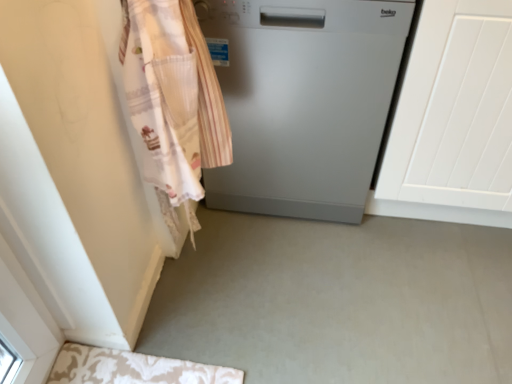
Question: From the image's perspective, is white lace apron at left below satin silver dishwasher at center?

Choices:
 (A) no
 (B) yes

Answer: (B)

Question: Is white lace apron at left at the left side of satin silver dishwasher at center?

Choices:
 (A) no
 (B) yes

Answer: (B)

Question: Considering the relative sizes of white lace apron at left and satin silver dishwasher at center in the image provided, is white lace apron at left taller than satin silver dishwasher at center?

Choices:
 (A) yes
 (B) no

Answer: (A)

Question: Is white lace apron at left positioned behind satin silver dishwasher at center?

Choices:
 (A) no
 (B) yes

Answer: (A)

Question: From the image's perspective, is white lace apron at left above satin silver dishwasher at center?

Choices:
 (A) no
 (B) yes

Answer: (A)

Question: In terms of width, does white lace apron at left look wider or thinner when compared to satin silver dishwasher at center?

Choices:
 (A) wide
 (B) thin

Answer: (B)

Question: Do you think white lace apron at left is within satin silver dishwasher at center, or outside of it?

Choices:
 (A) outside
 (B) inside

Answer: (A)

Question: Considering the positions of white lace apron at left and satin silver dishwasher at center in the image, is white lace apron at left bigger or smaller than satin silver dishwasher at center?

Choices:
 (A) big
 (B) small

Answer: (B)

Question: Does point (153, 135) appear closer or farther from the camera than point (266, 206)?

Choices:
 (A) farther
 (B) closer

Answer: (B)

Question: In terms of size, does satin silver dishwasher at center appear bigger or smaller than white textured door at right?

Choices:
 (A) big
 (B) small

Answer: (B)

Question: Relative to white textured door at right, is satin silver dishwasher at center in front or behind?

Choices:
 (A) behind
 (B) front

Answer: (A)

Question: From a real-world perspective, is satin silver dishwasher at center above or below white textured door at right?

Choices:
 (A) above
 (B) below

Answer: (B)

Question: In terms of height, does satin silver dishwasher at center look taller or shorter compared to white textured door at right?

Choices:
 (A) short
 (B) tall

Answer: (A)

Question: Looking at their shapes, would you say white textured door at right is wider or thinner than white lace apron at left?

Choices:
 (A) wide
 (B) thin

Answer: (A)

Question: Visually, is white textured door at right positioned to the left or to the right of white lace apron at left?

Choices:
 (A) right
 (B) left

Answer: (A)